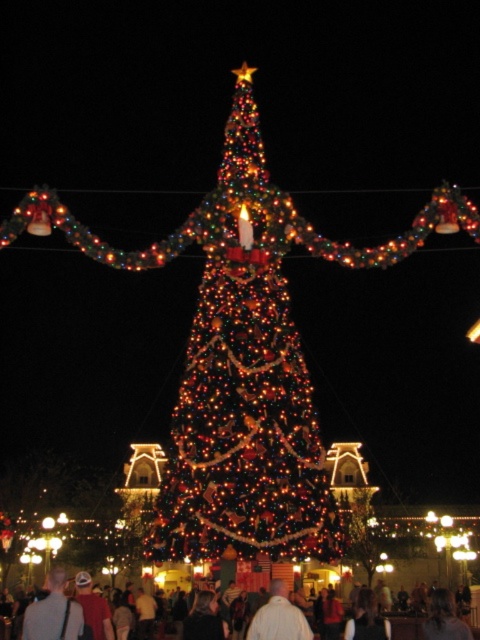
You are standing in front of the festive Christmas tree and notice a white matte shirt at center and a dark brown leather jacket at lower right. Which item is nearer to you?

The white matte shirt at center is closer to the viewer than the dark brown leather jacket at lower right.

Consider the image. You are a guest at a Christmas party and see the dark brown leather jacket at lower right and the dark gray sweater at lower center. Which clothing item is closer to you?

The dark brown leather jacket at lower right is closer to you because it is in front of the dark gray sweater at lower center.

You are attending a Christmas party and see a white matte shirt at center and a dark brown leather jacket at lower right. Which clothing item is positioned higher in the image?

The white matte shirt at center is positioned higher than the dark brown leather jacket at lower right.